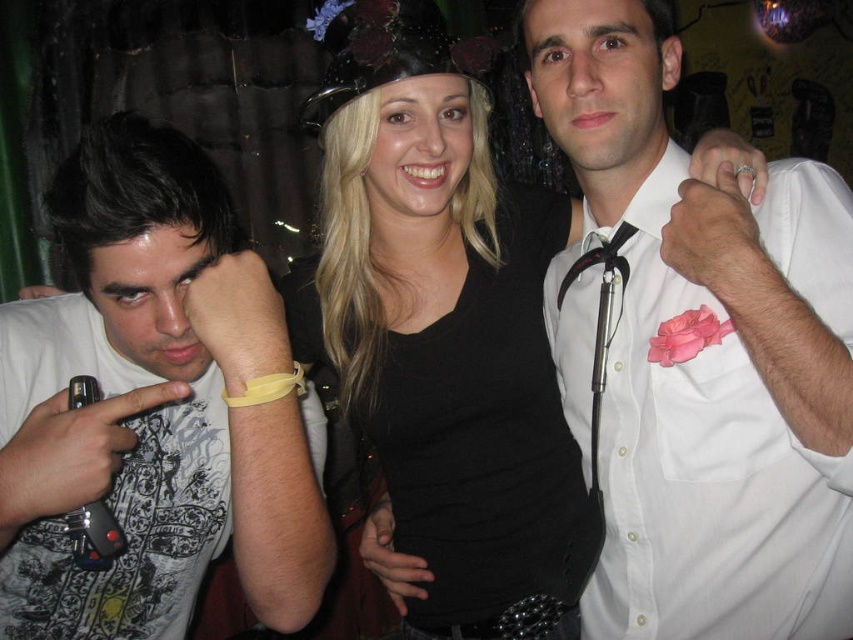
Is point (730, 396) behind point (178, 451)?

No, it is not.

Based on the photo, is white satin shirt at center smaller than white printed t-shirt at left?

Yes.

Does point (701, 522) lie behind point (210, 388)?

No, (701, 522) is closer to viewer.

Locate an element on the screen. The width and height of the screenshot is (853, 640). white satin shirt at center is located at coordinates (706, 355).

Can you confirm if white printed t-shirt at left is positioned to the right of black matte dress at center?

No, white printed t-shirt at left is not to the right of black matte dress at center.

Is white printed t-shirt at left in front of black matte dress at center?

Yes, it is in front of black matte dress at center.

Between point (68, 605) and point (503, 465), which one is positioned in front?

Point (68, 605)

Identify the location of white printed t-shirt at left. (154, 406).

Which is below, white satin shirt at center or black matte dress at center?

black matte dress at center

Does white satin shirt at center appear under black matte dress at center?

Actually, white satin shirt at center is above black matte dress at center.

Who is more distant from viewer, (741, 522) or (486, 336)?

Positioned behind is point (486, 336).

This screenshot has height=640, width=853. In order to click on white satin shirt at center in this screenshot , I will do `click(706, 355)`.